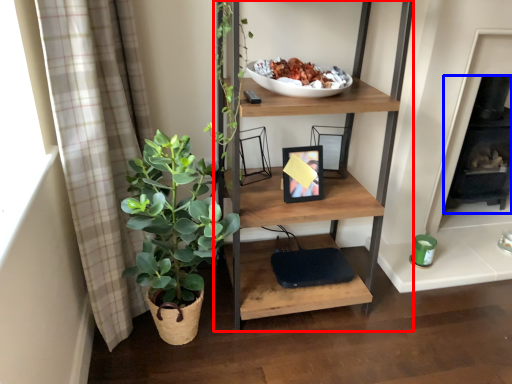
Question: Which object is further to the camera taking this photo, shelf (highlighted by a red box) or fireplace (highlighted by a blue box)?

Choices:
 (A) shelf
 (B) fireplace

Answer: (B)